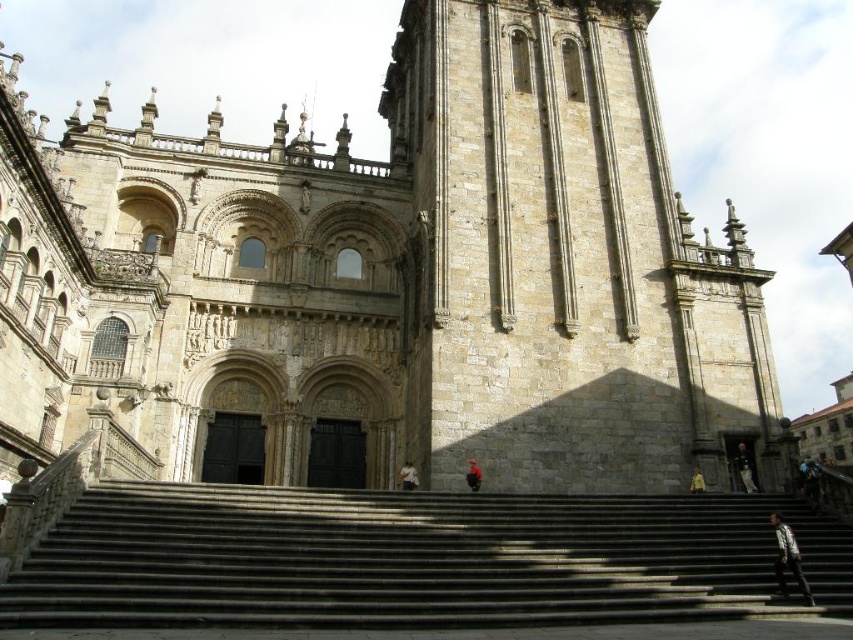
A drone is flying at a height of 40 meters above the ground. It wants to take a photo of the point at coordinate point (462, 496). If the drone is currently at the tower, which is 41.81 meters away from the point, can it capture the point in its photo without moving horizontally?

The drone is 40 meters above the ground, and the point is 41.81 meters away horizontally. Since the drone is at the same elevation as the tower, it cannot capture the point in its photo without moving horizontally because the horizontal distance exceeds the drone height, resulting in the point being out of the camera view.

You are standing at the entrance of the historic stone building and notice a red fabric person at center. Based on their position, can you determine if they are closer to the central doorway or the right tower?

The red fabric person at center is located at point coordinates that place them closer to the central doorway than the right tower.

You are standing in front of the historic stone building and notice two points marked on the tower. The first point is at coordinates point [410,477] and the second at point [689,480]. Which point is closer to you as you face the building?

Point [410,477] is in front of point [689,480], so it is closer to you when facing the building.